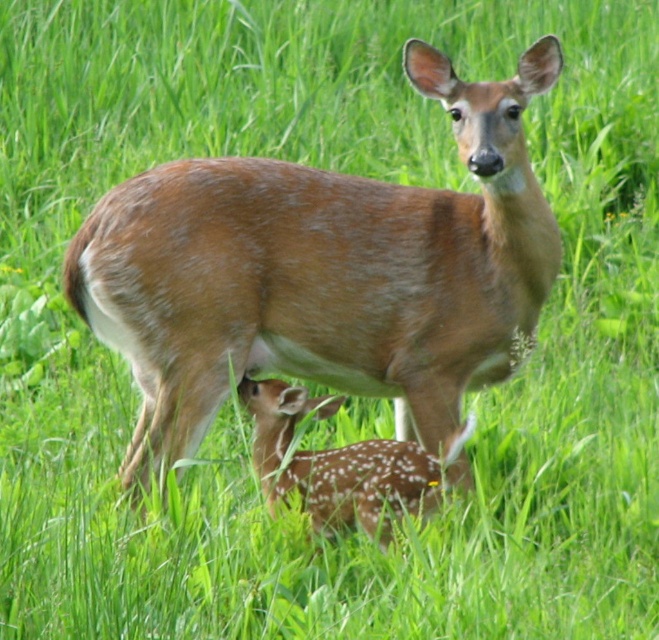
Question: Where is brown fuzzy deer at center located in relation to fawn fur fawn at center in the image?

Choices:
 (A) right
 (B) left

Answer: (B)

Question: Which point is farther to the camera?

Choices:
 (A) (171, 296)
 (B) (302, 464)

Answer: (B)

Question: Which of the following is the closest to the observer?

Choices:
 (A) coord(266,452)
 (B) coord(101,209)

Answer: (B)

Question: Does brown fuzzy deer at center have a greater width compared to fawn fur fawn at center?

Choices:
 (A) yes
 (B) no

Answer: (A)

Question: Does brown fuzzy deer at center appear on the left side of fawn fur fawn at center?

Choices:
 (A) no
 (B) yes

Answer: (B)